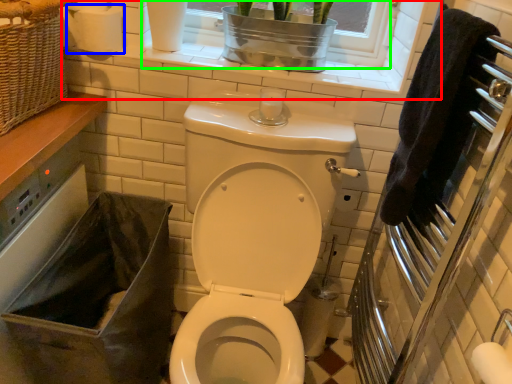
Question: Considering the real-world distances, which object is closest to window frame (highlighted by a red box)? toilet paper (highlighted by a blue box) or window frame (highlighted by a green box).

Choices:
 (A) toilet paper
 (B) window frame

Answer: (B)